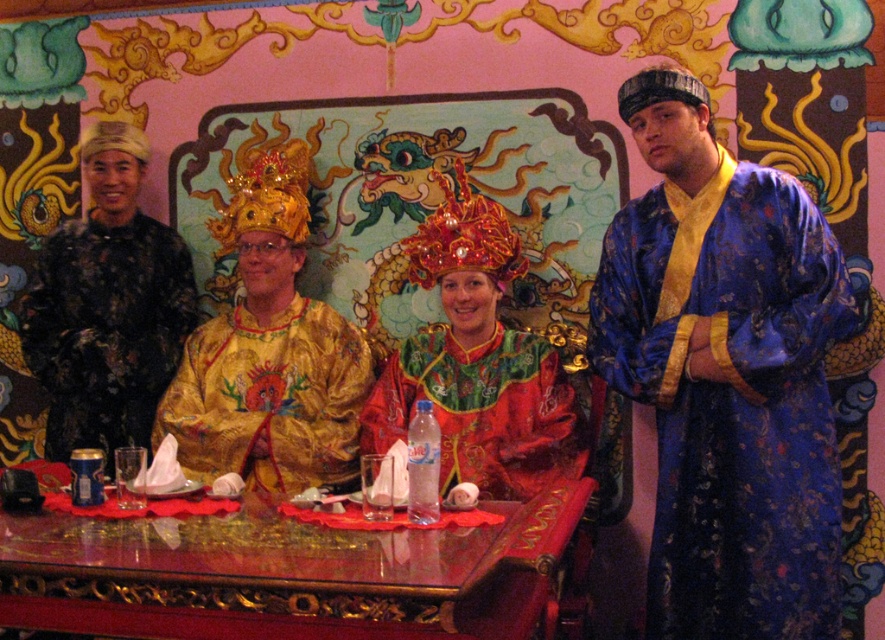
Question: Considering the real-world distances, which object is farthest from the gold brocade robe at left?

Choices:
 (A) gold shiny robe at center
 (B) shiny red fabric dress at center
 (C) glossy wooden table at center

Answer: (C)

Question: Among these points, which one is farthest from the camera?

Choices:
 (A) (58, 228)
 (B) (553, 435)
 (C) (214, 570)
 (D) (812, 248)

Answer: (A)

Question: Which of these objects is positioned closest to the glossy wooden table at center?

Choices:
 (A) gold brocade robe at left
 (B) shiny red fabric dress at center
 (C) blue silk robe at center

Answer: (B)

Question: Considering the relative positions of glossy wooden table at center and gold brocade robe at left in the image provided, where is glossy wooden table at center located with respect to gold brocade robe at left?

Choices:
 (A) below
 (B) above

Answer: (A)

Question: Can you confirm if shiny red fabric dress at center is positioned below gold brocade robe at left?

Choices:
 (A) yes
 (B) no

Answer: (A)

Question: Can you confirm if shiny red fabric dress at center is thinner than gold brocade robe at left?

Choices:
 (A) no
 (B) yes

Answer: (A)